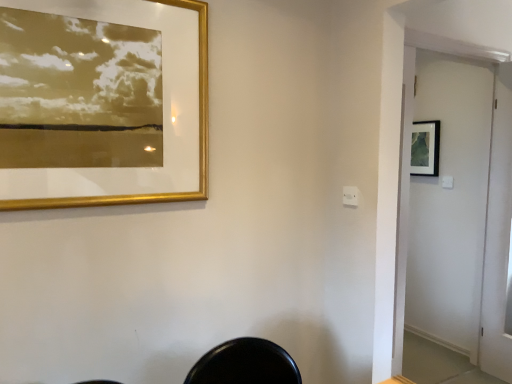
Question: Relative to gold metallic picture frame at upper left, placed as the first picture frame when sorted from front to back, is white glossy screen door at right in front or behind?

Choices:
 (A) front
 (B) behind

Answer: (B)

Question: From the image's perspective, is white glossy screen door at right located above or below gold metallic picture frame at upper left, acting as the second picture frame starting from the right?

Choices:
 (A) above
 (B) below

Answer: (B)

Question: Which is nearer to the white glossy screen door at right?

Choices:
 (A) matte black picture frame at upper right, which is counted as the 1th picture frame, starting from the right
 (B) gold metallic picture frame at upper left, placed as the first picture frame when sorted from front to back

Answer: (A)

Question: Which of these objects is positioned closest to the white glossy screen door at right?

Choices:
 (A) gold metallic picture frame at upper left, placed as the first picture frame when sorted from front to back
 (B) matte black picture frame at upper right, which is the second picture frame in left-to-right order

Answer: (B)